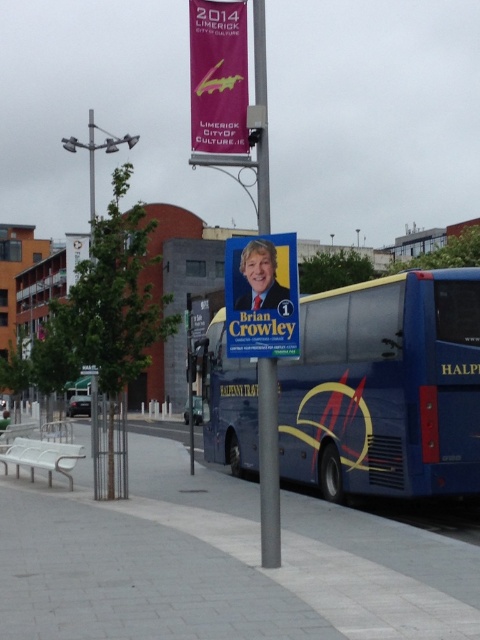
Question: Which of the following is the farthest from the observer?

Choices:
 (A) (100, 614)
 (B) (403, 312)

Answer: (B)

Question: Does gray concrete pavement at center have a lesser width compared to blue metallic bus at center?

Choices:
 (A) yes
 (B) no

Answer: (B)

Question: Which object is positioned farthest from the matte purple banner at upper center?

Choices:
 (A) gray concrete pavement at center
 (B) blue metallic bus at center
 (C) matte blue poster at center

Answer: (C)

Question: Which of the following is the closest to the observer?

Choices:
 (A) (228, 115)
 (B) (431, 484)
 (C) (237, 346)
 (D) (207, 612)

Answer: (D)

Question: Is gray concrete pavement at center above matte blue poster at center?

Choices:
 (A) yes
 (B) no

Answer: (B)

Question: Does blue metallic bus at center have a greater width compared to matte purple banner at upper center?

Choices:
 (A) no
 (B) yes

Answer: (A)